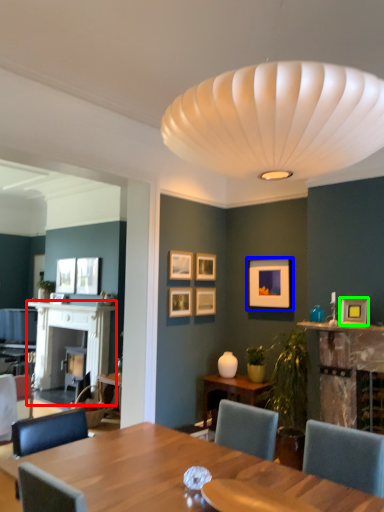
Question: Which is nearer to the fireplace (highlighted by a red box)? picture frame (highlighted by a blue box) or picture frame (highlighted by a green box).

Choices:
 (A) picture frame
 (B) picture frame

Answer: (A)